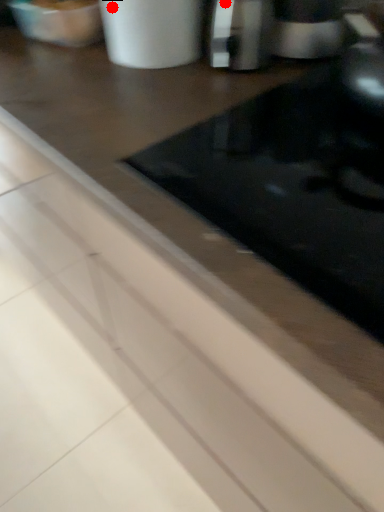
Question: Two points are circled on the image, labeled by A and B beside each circle. Which of the following is the farthest from the observer?

Choices:
 (A) A is further
 (B) B is further

Answer: (B)